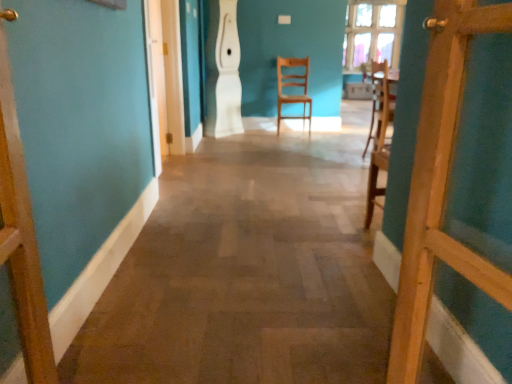
Question: Is wooden door at right inside the boundaries of clear glass window at upper center, or outside?

Choices:
 (A) inside
 (B) outside

Answer: (B)

Question: Does point (401, 345) appear closer or farther from the camera than point (389, 6)?

Choices:
 (A) closer
 (B) farther

Answer: (A)

Question: Which of these objects is positioned farthest from the light wood chair at center, the first chair when ordered from left to right?

Choices:
 (A) wooden door at right
 (B) wooden chair at right, the 2th chair viewed from the back
 (C) clear glass window at upper center
 (D) wooden floor at center

Answer: (A)

Question: Which object is the closest to the light wood chair at center, placed as the second chair when sorted from front to back?

Choices:
 (A) wooden floor at center
 (B) wooden chair at right, placed as the second chair when sorted from left to right
 (C) wooden door at right
 (D) clear glass window at upper center

Answer: (D)